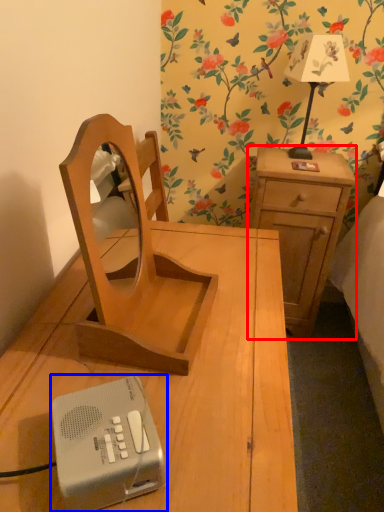
Question: Which of the following is the closest to the observer, nightstand (highlighted by a red box) or gadget (highlighted by a blue box)?

Choices:
 (A) nightstand
 (B) gadget

Answer: (B)